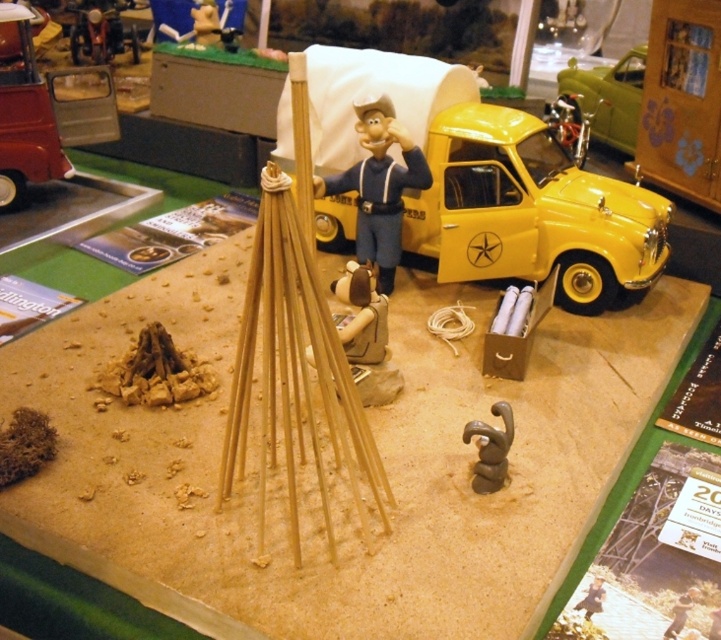
Question: Does yellow matte toy car at upper right appear on the left side of smooth brown wooden stick at center?

Choices:
 (A) yes
 (B) no

Answer: (A)

Question: Observing the image, what is the correct spatial positioning of green metallic car at upper right in reference to metallic silver toy at upper left?

Choices:
 (A) right
 (B) left

Answer: (A)

Question: Which of these objects is positioned farthest from the metallic silver bicycle at upper right?

Choices:
 (A) smooth brown wooden stick at center
 (B) green metallic car at upper right
 (C) brown clay figurine at lower right
 (D) yellow matte toy car at upper right

Answer: (A)

Question: Which of these objects is positioned closest to the yellow matte toy car at upper right?

Choices:
 (A) brown clay figurine at lower right
 (B) wooden stick at lower right
 (C) metallic silver bicycle at upper right
 (D) blue fabric sailor at center

Answer: (D)

Question: Which is nearer to the wooden stick at lower right?

Choices:
 (A) metallic silver toy at upper left
 (B) metallic silver bicycle at upper right
 (C) brown clay figurine at lower right

Answer: (C)

Question: Can you confirm if brown clay figurine at lower right is positioned above metallic silver bicycle at upper right?

Choices:
 (A) no
 (B) yes

Answer: (A)